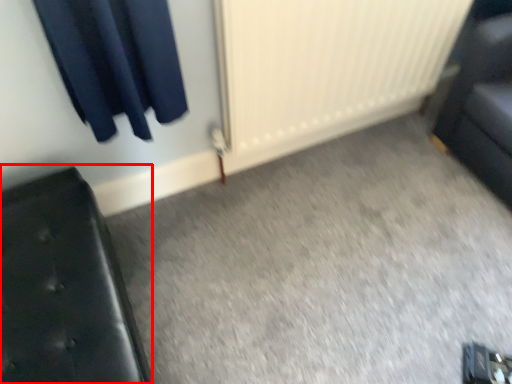
Question: From the image's perspective, considering the relative positions of furniture (annotated by the red box) and radiator in the image provided, where is furniture (annotated by the red box) located with respect to the staircase?

Choices:
 (A) below
 (B) above

Answer: (A)